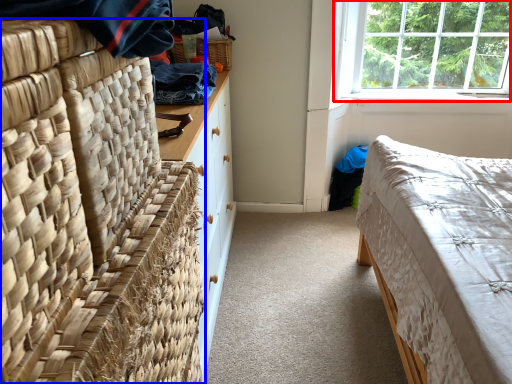
Question: Which object is closer to the camera taking this photo, window (highlighted by a red box) or furniture (highlighted by a blue box)?

Choices:
 (A) window
 (B) furniture

Answer: (B)